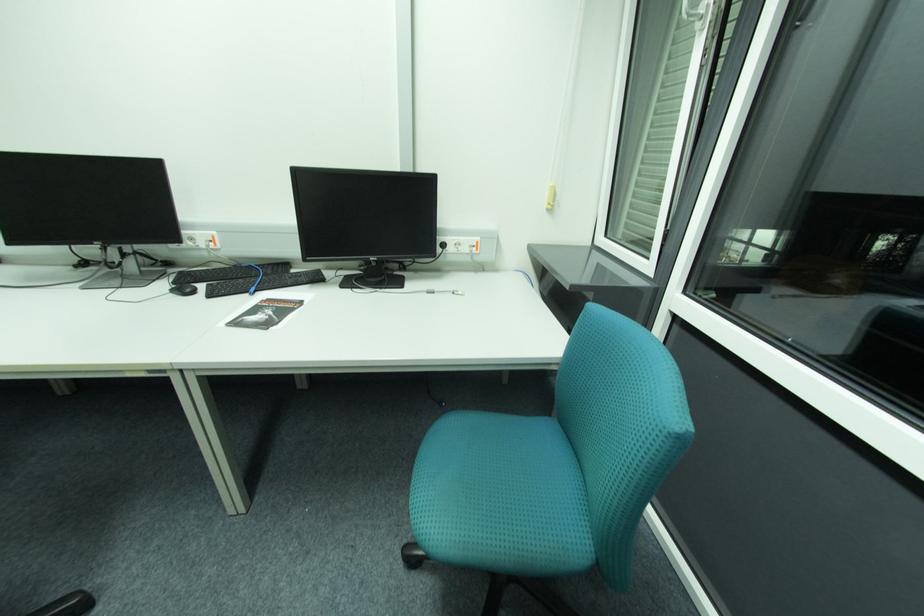
The width and height of the screenshot is (924, 616). I want to click on yellow blind pull tab, so click(551, 197).